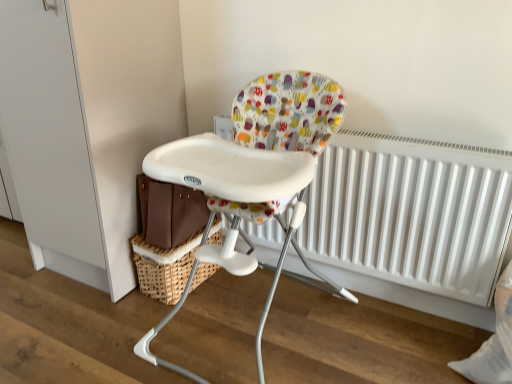
Question: Is white matte radiator at center not close to white plastic highchair at center?

Choices:
 (A) no
 (B) yes

Answer: (A)

Question: Is white matte radiator at center facing away from white plastic highchair at center?

Choices:
 (A) no
 (B) yes

Answer: (A)

Question: From a real-world perspective, is white matte radiator at center located beneath white plastic highchair at center?

Choices:
 (A) no
 (B) yes

Answer: (B)

Question: Is white plastic highchair at center surrounded by white matte radiator at center?

Choices:
 (A) yes
 (B) no

Answer: (B)

Question: Is the position of white matte radiator at center more distant than that of white plastic highchair at center?

Choices:
 (A) yes
 (B) no

Answer: (A)

Question: Does white matte radiator at center appear on the right side of white plastic highchair at center?

Choices:
 (A) yes
 (B) no

Answer: (A)

Question: From the image's perspective, is woven brown basket at lower left located beneath white matte radiator at center?

Choices:
 (A) yes
 (B) no

Answer: (A)

Question: Is woven brown basket at lower left looking in the opposite direction of white matte radiator at center?

Choices:
 (A) no
 (B) yes

Answer: (A)

Question: Can you confirm if woven brown basket at lower left is wider than white matte radiator at center?

Choices:
 (A) no
 (B) yes

Answer: (B)

Question: Is white matte radiator at center inside woven brown basket at lower left?

Choices:
 (A) yes
 (B) no

Answer: (B)

Question: Is woven brown basket at lower left next to white matte radiator at center and touching it?

Choices:
 (A) yes
 (B) no

Answer: (B)

Question: Is woven brown basket at lower left thinner than white matte radiator at center?

Choices:
 (A) no
 (B) yes

Answer: (A)

Question: Is white plastic highchair at center positioned beyond the bounds of woven brown basket at lower left?

Choices:
 (A) yes
 (B) no

Answer: (A)